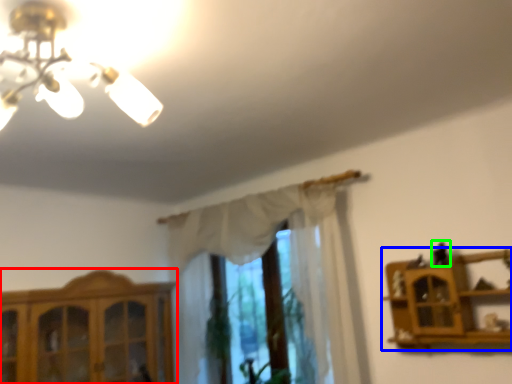
Question: Which is farther away from cabinetry (highlighted by a red box)? shelf (highlighted by a blue box) or toy (highlighted by a green box)?

Choices:
 (A) shelf
 (B) toy

Answer: (B)